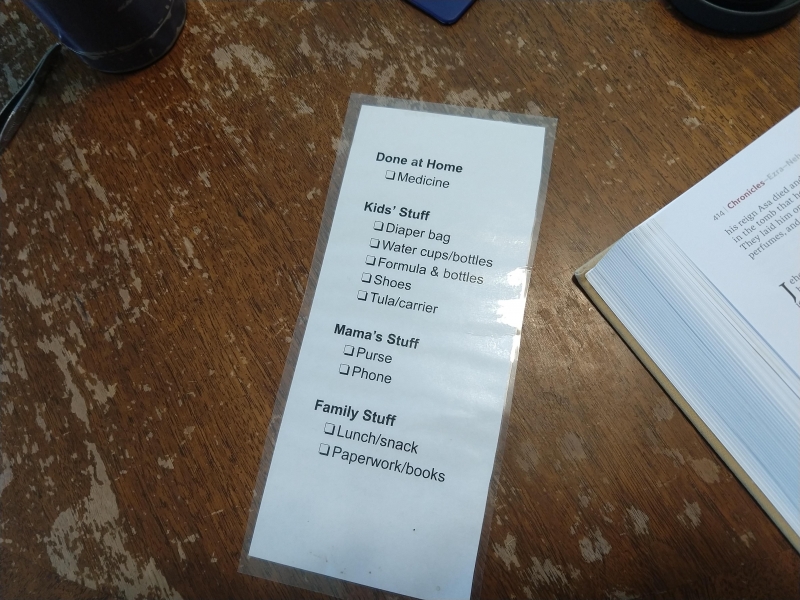
At what (x,y) coordinates should I click in order to perform the action: click on edge of book. Please return your answer as a coordinate pair (x, y). This screenshot has height=600, width=800. Looking at the image, I should click on (578, 278).